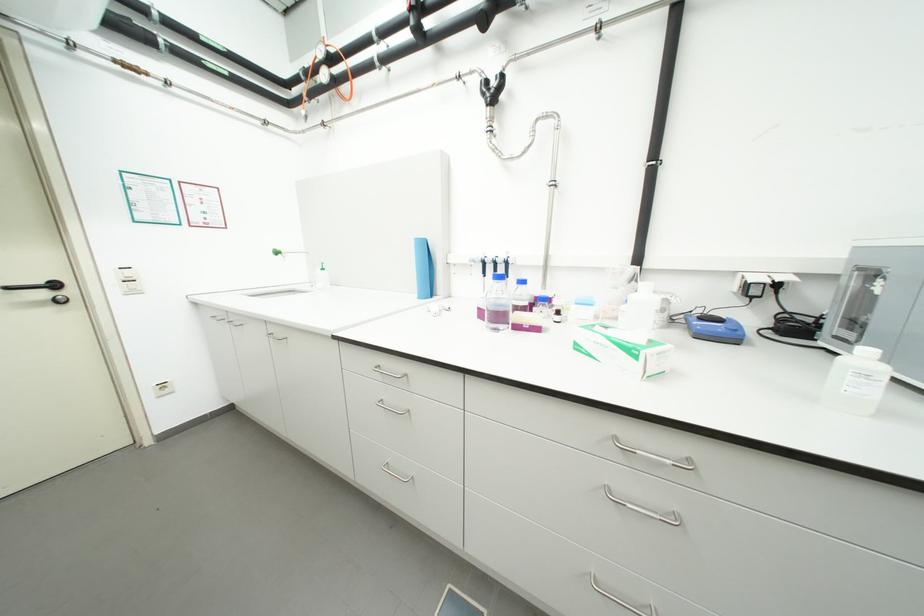
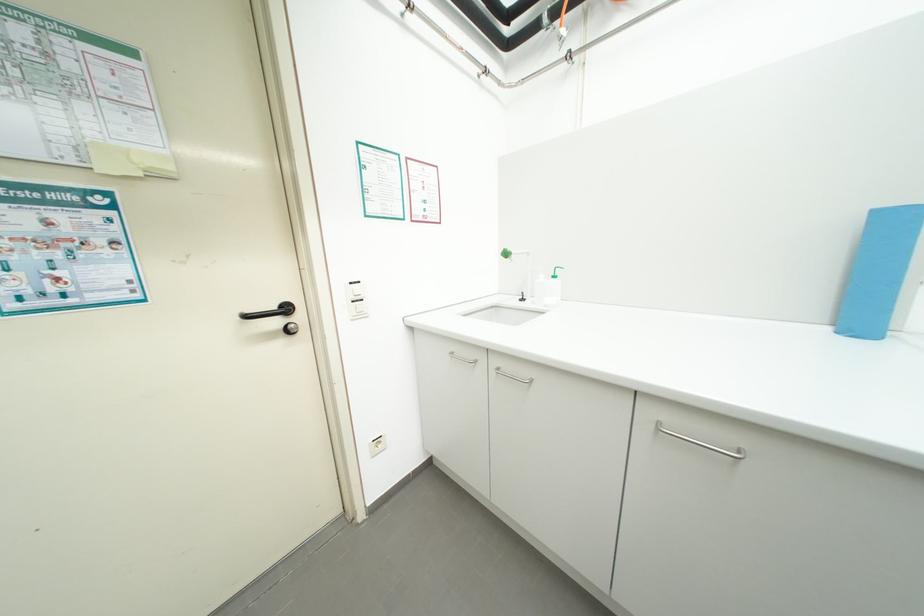
The point at (123, 289) is marked in the first image. Where is the corresponding point in the second image?

(351, 312)